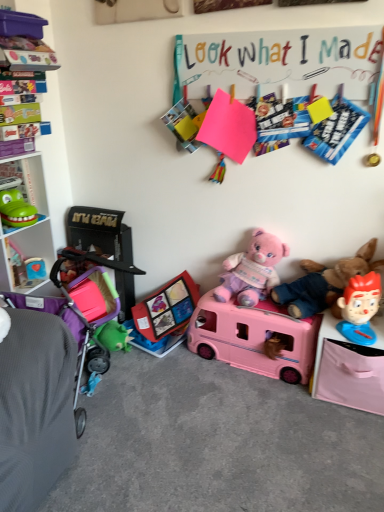
Question: Is pink plastic toy bus at center, placed as the 3th toy when sorted from left to right, next to green rubbery toy at left, arranged as the 4th toy when viewed from the right?

Choices:
 (A) yes
 (B) no

Answer: (B)

Question: Considering the relative sizes of pink plastic toy bus at center, marked as the first toy in a bottom-to-top arrangement, and green rubbery toy at left, which is the fourth toy in bottom-to-top order, in the image provided, is pink plastic toy bus at center, marked as the first toy in a bottom-to-top arrangement, smaller than green rubbery toy at left, which is the fourth toy in bottom-to-top order,?

Choices:
 (A) yes
 (B) no

Answer: (B)

Question: Is pink plastic toy bus at center, the fourth toy positioned from the top, not near green rubbery toy at left, positioned as the 1th toy in top-to-bottom order?

Choices:
 (A) yes
 (B) no

Answer: (A)

Question: From a real-world perspective, is pink plastic toy bus at center, marked as the first toy in a bottom-to-top arrangement, physically below green rubbery toy at left, positioned as the 1th toy in top-to-bottom order?

Choices:
 (A) no
 (B) yes

Answer: (B)

Question: Would you say pink plastic toy bus at center, marked as the first toy in a bottom-to-top arrangement, is outside green rubbery toy at left, positioned as the 1th toy in top-to-bottom order?

Choices:
 (A) yes
 (B) no

Answer: (A)

Question: Considering the relative sizes of pink plastic toy bus at center, the second toy from the right, and green rubbery toy at left, which is the fourth toy in bottom-to-top order, in the image provided, is pink plastic toy bus at center, the second toy from the right, shorter than green rubbery toy at left, which is the fourth toy in bottom-to-top order,?

Choices:
 (A) yes
 (B) no

Answer: (B)

Question: Is pink plastic changing table at lower right far away from green rubbery toy at left, positioned as the 1th toy in top-to-bottom order?

Choices:
 (A) yes
 (B) no

Answer: (A)

Question: Can you see pink plastic changing table at lower right touching green rubbery toy at left, arranged as the 4th toy when viewed from the right?

Choices:
 (A) no
 (B) yes

Answer: (A)

Question: From the image's perspective, is pink plastic changing table at lower right on green rubbery toy at left, which is the fourth toy in bottom-to-top order?

Choices:
 (A) yes
 (B) no

Answer: (B)

Question: Could you tell me if pink plastic changing table at lower right is turned towards green rubbery toy at left, which is the fourth toy in bottom-to-top order?

Choices:
 (A) no
 (B) yes

Answer: (A)

Question: From a real-world perspective, is pink plastic changing table at lower right positioned over green rubbery toy at left, positioned as the 1th toy in top-to-bottom order, based on gravity?

Choices:
 (A) no
 (B) yes

Answer: (A)

Question: Does pink plastic changing table at lower right have a lesser width compared to green rubbery toy at left, positioned as the 1th toy in top-to-bottom order?

Choices:
 (A) no
 (B) yes

Answer: (A)

Question: Is pink plastic toy bus at center, marked as the first toy in a bottom-to-top arrangement, smaller than smooth red plastic toy at right, the third toy in the top-to-bottom sequence?

Choices:
 (A) yes
 (B) no

Answer: (B)